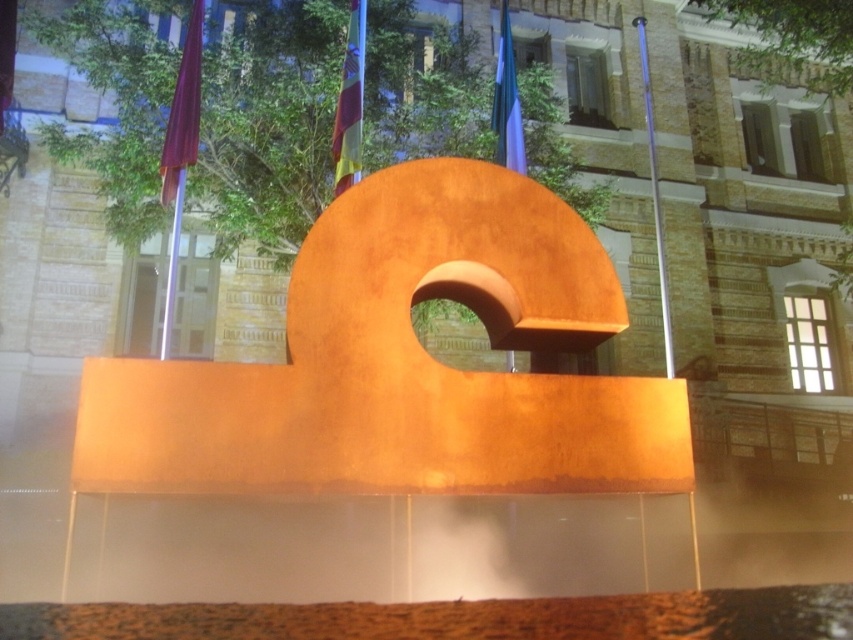
Question: Observing the image, what is the correct spatial positioning of silky fabric flag at upper center in reference to silky blue flag at upper center?

Choices:
 (A) left
 (B) right

Answer: (A)

Question: Which point is farther to the camera?

Choices:
 (A) (607, 426)
 (B) (332, 144)

Answer: (B)

Question: Which object is farther from the camera taking this photo?

Choices:
 (A) rustic wood sculpture at center
 (B) silky fabric flag at upper center
 (C) silky blue flag at upper center

Answer: (C)

Question: Considering the relative positions of matte red flag at upper left and silky fabric flag at upper center in the image provided, where is matte red flag at upper left located with respect to silky fabric flag at upper center?

Choices:
 (A) above
 (B) below

Answer: (B)

Question: Is matte red flag at upper left to the left of silky fabric flag at upper center from the viewer's perspective?

Choices:
 (A) no
 (B) yes

Answer: (B)

Question: Which object is closer to the camera taking this photo?

Choices:
 (A) matte red flag at upper left
 (B) rustic wood sculpture at center
 (C) silky fabric flag at upper center

Answer: (B)